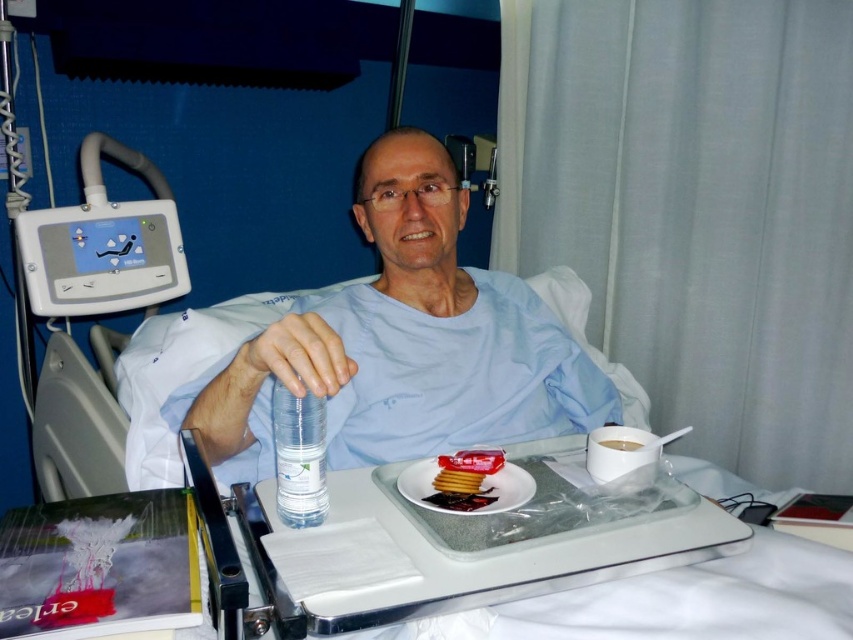
Measure the distance between point (291,444) and camera.

29.38 inches

Does point (274, 404) lie behind point (434, 477)?

No, (274, 404) is closer to viewer.

Where is `transparent plastic bottle at center`? The image size is (853, 640). transparent plastic bottle at center is located at coordinates click(x=299, y=458).

Is transparent plastic bottle at center wider than glossy plastic jam at center?

In fact, transparent plastic bottle at center might be narrower than glossy plastic jam at center.

Based on the photo, who is positioned more to the right, transparent plastic bottle at center or glossy plastic jam at center?

glossy plastic jam at center is more to the right.

The width and height of the screenshot is (853, 640). Identify the location of transparent plastic bottle at center. (299, 458).

Between clear plastic tray at center and translucent plastic crackers at tray center, which one is positioned lower?

translucent plastic crackers at tray center is lower down.

Who is positioned more to the right, clear plastic tray at center or translucent plastic crackers at tray center?

translucent plastic crackers at tray center is more to the right.

Describe the element at coordinates (682, 602) in the screenshot. I see `clear plastic tray at center` at that location.

Identify the location of clear plastic tray at center. The width and height of the screenshot is (853, 640). (682, 602).